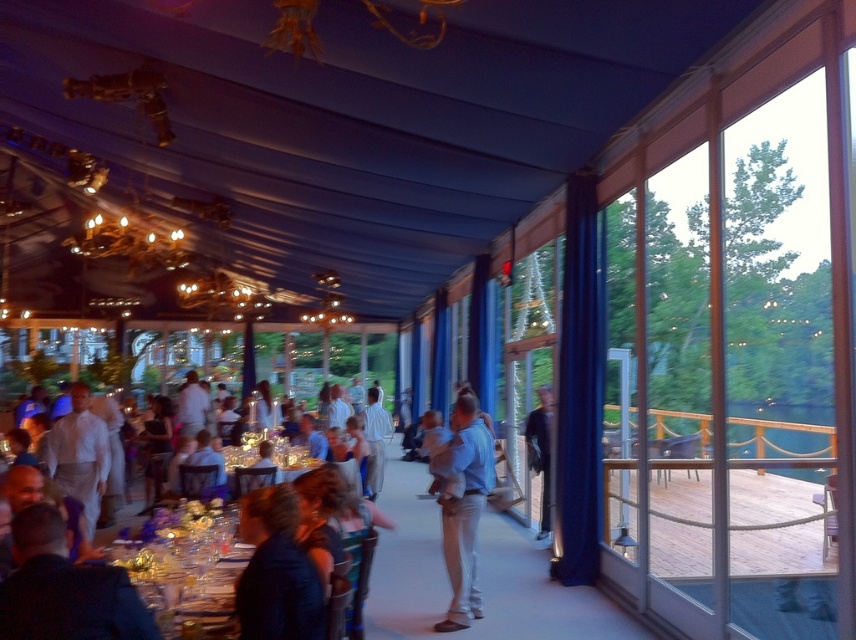
Is translucent glass table at lower left wider than dark blue suit at center?

Correct, the width of translucent glass table at lower left exceeds that of dark blue suit at center.

Which of these two, translucent glass table at lower left or dark blue suit at center, stands taller?

dark blue suit at center

Describe the element at coordinates (187, 566) in the screenshot. I see `translucent glass table at lower left` at that location.

Image resolution: width=856 pixels, height=640 pixels. What are the coordinates of `translucent glass table at lower left` in the screenshot? It's located at (187, 566).

Does translucent glass table at lower left lie in front of dark blue fabric at center?

That is False.

Does translucent glass table at lower left lie behind dark blue fabric at center?

Yes, translucent glass table at lower left is further from the viewer.

Which is in front, point (173, 586) or point (277, 586)?

Point (277, 586)

Find the location of `translucent glass table at lower left`. translucent glass table at lower left is located at coordinates (187, 566).

Can you confirm if blue cotton shirt at center is positioned to the right of dark blue suit at center?

Incorrect, blue cotton shirt at center is not on the right side of dark blue suit at center.

Based on the photo, between blue cotton shirt at center and dark blue suit at center, which one appears on the left side from the viewer's perspective?

Positioned to the left is blue cotton shirt at center.

Between point (465, 566) and point (526, 438), which one is positioned in front?

Point (465, 566)

The height and width of the screenshot is (640, 856). Find the location of `blue cotton shirt at center`. blue cotton shirt at center is located at coordinates (462, 506).